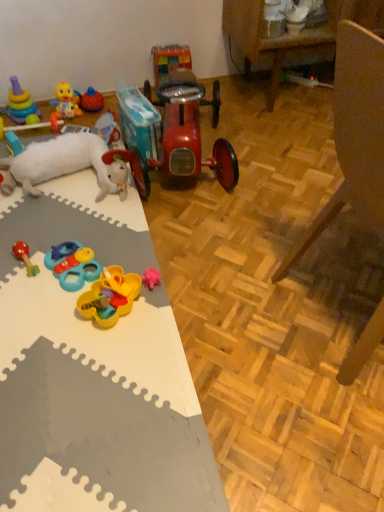
Identify the location of vacant area that is in front of plastic/soft yellow and blue toy at lower left, the 8th toy positioned from the left. This screenshot has width=384, height=512. (52, 317).